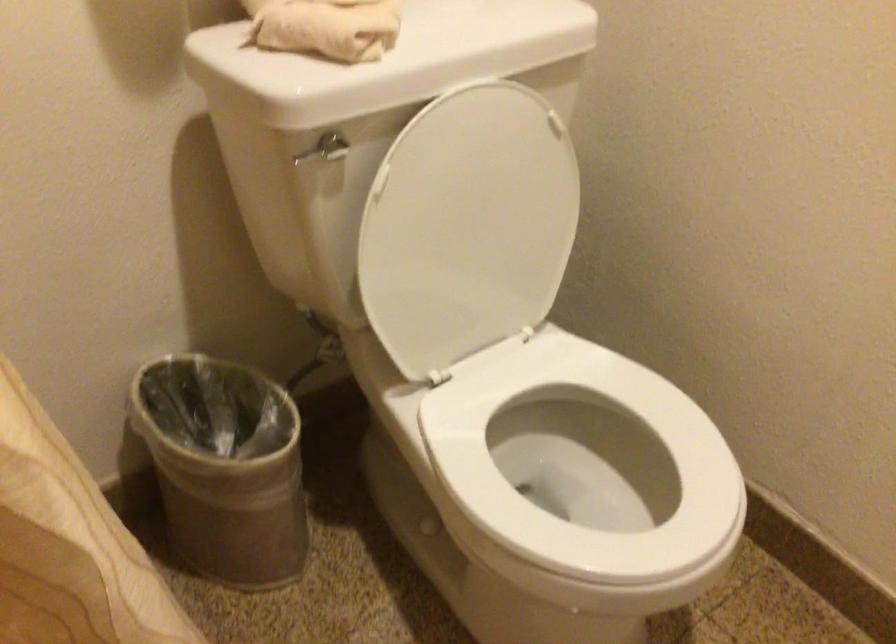
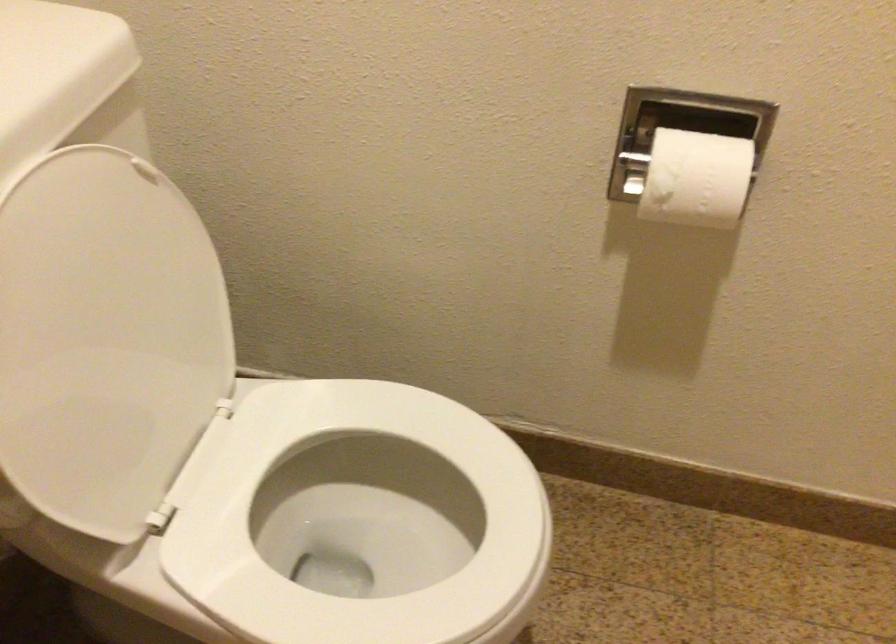
Where in the second image is the point corresponding to pixel 462 225 from the first image?

(105, 339)